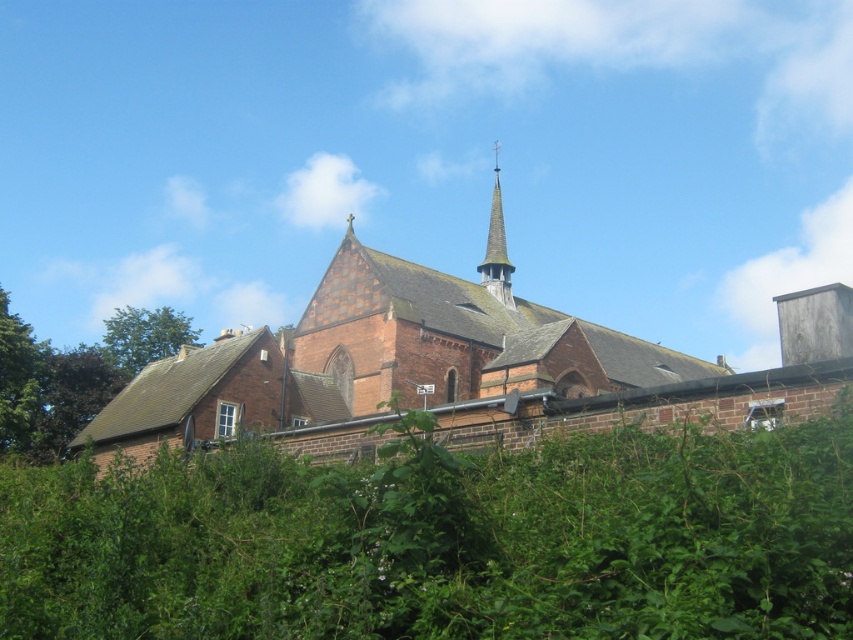
Between red brick church at center and green leafy tree at left, which one has more height?

red brick church at center is taller.

Describe the element at coordinates (456, 369) in the screenshot. This screenshot has width=853, height=640. I see `red brick church at center` at that location.

Is point (589, 372) less distant than point (28, 332)?

Yes, point (589, 372) is in front of point (28, 332).

This screenshot has height=640, width=853. I want to click on red brick church at center, so click(x=456, y=369).

Which is more to the left, green leafy tree at upper left or smooth gray spire at upper center?

Positioned to the left is green leafy tree at upper left.

Between point (111, 326) and point (502, 300), which one is positioned in front?

Point (502, 300)

Locate an element on the screen. Image resolution: width=853 pixels, height=640 pixels. green leafy tree at upper left is located at coordinates (144, 336).

Can you confirm if green leafy tree at lower left is positioned below green leafy tree at upper left?

Indeed, green leafy tree at lower left is positioned under green leafy tree at upper left.

Does point (71, 406) lie behind point (160, 355)?

No, it is not.

What do you see at coordinates (73, 374) in the screenshot? The width and height of the screenshot is (853, 640). I see `green leafy tree at lower left` at bounding box center [73, 374].

Find the location of a particular element. green leafy tree at lower left is located at coordinates (73, 374).